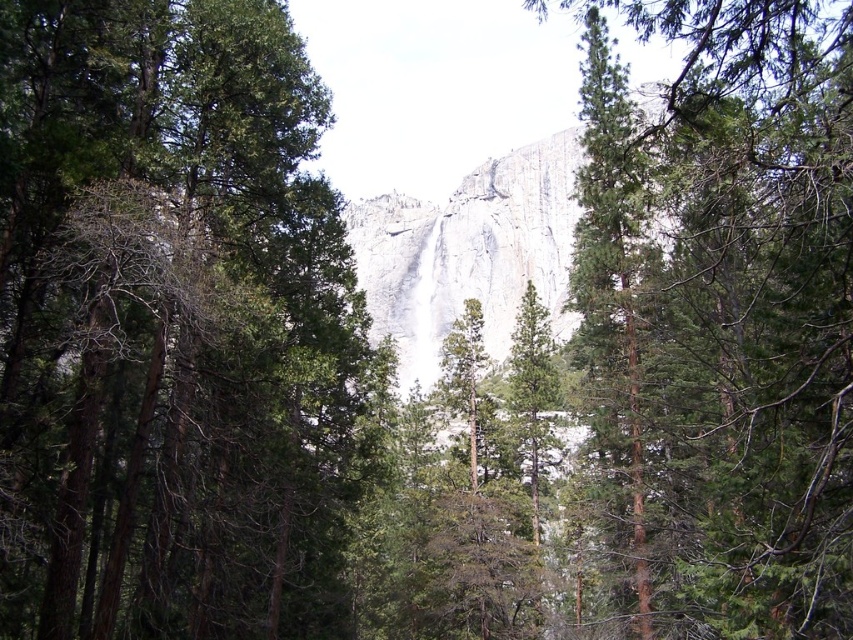
You are standing at the point marked as point (44,426) in the image. You want to cross the frozen waterfall but need to know the distance between you and the nearest safe path. The safe path is located at the other side of the waterfall. Can you determine if the distance is less than 200 feet?

The distance between you and the nearest safe path at the other side of the waterfall is 182.21 feet, which is less than 200 feet. Therefore, you can safely cross the frozen waterfall.

You are standing at the base of the waterfall and see two points marked in the scene. The first point is at coordinates point (x=221, y=580) and the second is at point (x=572, y=216). Which point is closer to you?

Point (x=221, y=580) is in front of point (x=572, y=216), so it is closer to you.